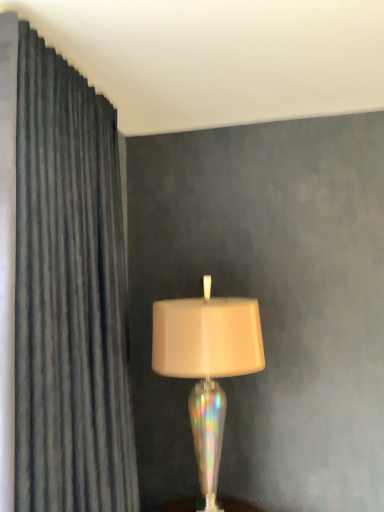
Question: Does dark gray textured curtain at left have a greater height compared to iridescent glass lamp at center?

Choices:
 (A) yes
 (B) no

Answer: (A)

Question: Is dark gray textured curtain at left shorter than iridescent glass lamp at center?

Choices:
 (A) yes
 (B) no

Answer: (B)

Question: Is dark gray textured curtain at left outside of iridescent glass lamp at center?

Choices:
 (A) yes
 (B) no

Answer: (A)

Question: From the image's perspective, would you say dark gray textured curtain at left is shown under iridescent glass lamp at center?

Choices:
 (A) no
 (B) yes

Answer: (A)

Question: From a real-world perspective, does dark gray textured curtain at left sit lower than iridescent glass lamp at center?

Choices:
 (A) no
 (B) yes

Answer: (A)

Question: Is dark gray textured curtain at left bigger than iridescent glass lamp at center?

Choices:
 (A) yes
 (B) no

Answer: (A)

Question: Is iridescent glass lamp at center aimed at dark gray textured curtain at left?

Choices:
 (A) yes
 (B) no

Answer: (B)

Question: Is iridescent glass lamp at center positioned beyond the bounds of dark gray textured curtain at left?

Choices:
 (A) yes
 (B) no

Answer: (A)

Question: Is iridescent glass lamp at center positioned before dark gray textured curtain at left?

Choices:
 (A) no
 (B) yes

Answer: (A)

Question: From the image's perspective, would you say iridescent glass lamp at center is positioned over dark gray textured curtain at left?

Choices:
 (A) yes
 (B) no

Answer: (B)

Question: From a real-world perspective, is iridescent glass lamp at center located beneath dark gray textured curtain at left?

Choices:
 (A) yes
 (B) no

Answer: (A)

Question: Considering the relative sizes of iridescent glass lamp at center and dark gray textured curtain at left in the image provided, is iridescent glass lamp at center wider than dark gray textured curtain at left?

Choices:
 (A) yes
 (B) no

Answer: (A)

Question: In the image, is iridescent glass lamp at center positioned in front of or behind dark gray textured curtain at left?

Choices:
 (A) front
 (B) behind

Answer: (B)